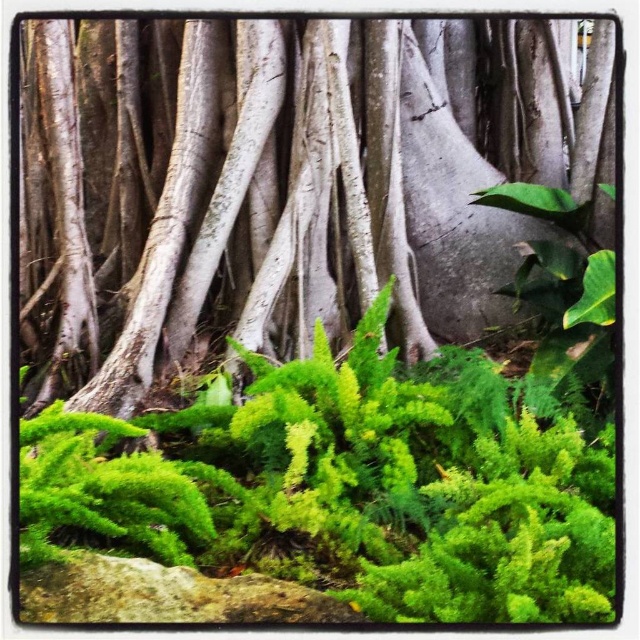
Question: Is smooth gray bark at center further to camera compared to gray rough stone at lower center?

Choices:
 (A) no
 (B) yes

Answer: (B)

Question: Among these points, which one is farthest from the camera?

Choices:
 (A) (29, 272)
 (B) (144, 605)

Answer: (A)

Question: Which of the following is the closest to the observer?

Choices:
 (A) gray rough stone at lower center
 (B) smooth gray bark at center

Answer: (A)

Question: Can you confirm if smooth gray bark at center is positioned to the left of gray rough stone at lower center?

Choices:
 (A) yes
 (B) no

Answer: (B)

Question: Is smooth gray bark at center wider than gray rough stone at lower center?

Choices:
 (A) no
 (B) yes

Answer: (B)